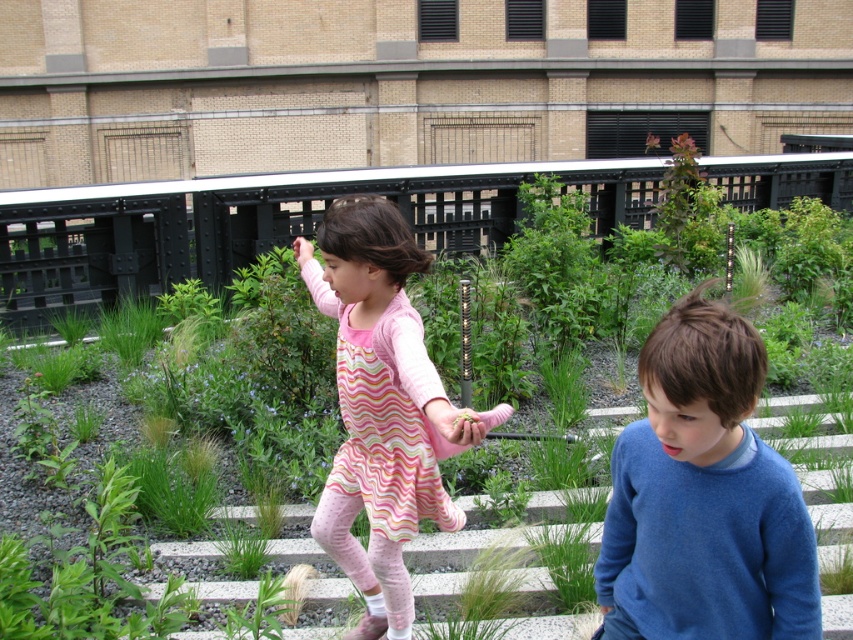
From the picture: You are a photographer trying to capture a closeup of the pink striped dress at center. Given that the green grass at center is blocking your view, can you determine if you can move the grass aside to get a clear shot?

The green grass at center is larger in size than pink striped dress at center. Since the grass is bigger, it might be harder to move aside, but you can try trimming or rearranging the grass to get a clear shot of the pink striped dress at center.

A cat is sitting on the green grass at center and wants to jump to the pink striped dress at center. Given that the cat can jump 10 feet in a single leap, will it be able to reach the dress in one jump?

The distance between the green grass at center and the pink striped dress at center is 12.64 feet. Since the cat can only jump 10 feet, it will not be able to reach the dress in a single jump.

You are a photographer trying to capture a photo of the pink striped dress at center and the white concrete stairs at center. Which object appears narrower in the photo?

The pink striped dress at center appears narrower than the white concrete stairs at center in the photo.